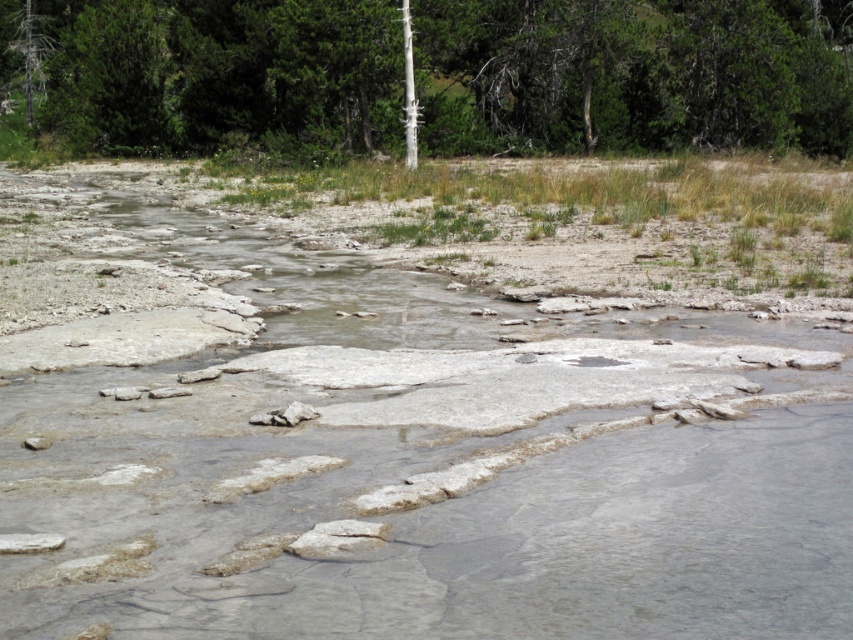
Between gray stone river at center and green textured tree at upper center, which one appears on the left side from the viewer's perspective?

green textured tree at upper center is more to the left.

Which is behind, point (346, 438) or point (776, 44)?

The point (776, 44) is more distant.

Who is more distant from viewer, (807, 593) or (846, 116)?

Positioned behind is point (846, 116).

Locate an element on the screen. This screenshot has height=640, width=853. gray stone river at center is located at coordinates (392, 444).